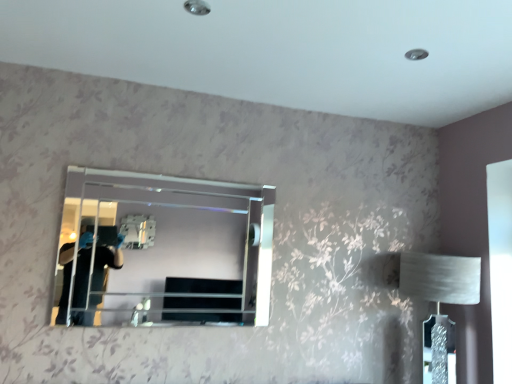
Question: Should I look upward or downward to see clear glass mirror at center?

Choices:
 (A) down
 (B) up

Answer: (A)

Question: Is white fabric lampshade at right at the left side of clear glass mirror at center?

Choices:
 (A) no
 (B) yes

Answer: (A)

Question: Is the depth of white fabric lampshade at right less than that of clear glass mirror at center?

Choices:
 (A) no
 (B) yes

Answer: (A)

Question: Does white fabric lampshade at right lie behind clear glass mirror at center?

Choices:
 (A) no
 (B) yes

Answer: (B)

Question: Considering the relative sizes of white fabric lampshade at right and clear glass mirror at center in the image provided, is white fabric lampshade at right thinner than clear glass mirror at center?

Choices:
 (A) yes
 (B) no

Answer: (B)

Question: Considering the relative sizes of white fabric lampshade at right and clear glass mirror at center in the image provided, is white fabric lampshade at right wider than clear glass mirror at center?

Choices:
 (A) yes
 (B) no

Answer: (A)

Question: Does white fabric lampshade at right have a lesser height compared to clear glass mirror at center?

Choices:
 (A) yes
 (B) no

Answer: (B)

Question: From a real-world perspective, does clear glass mirror at center stand above white fabric lampshade at right?

Choices:
 (A) yes
 (B) no

Answer: (A)

Question: Is clear glass mirror at center not near white fabric lampshade at right?

Choices:
 (A) no
 (B) yes

Answer: (B)

Question: Is clear glass mirror at center further to the viewer compared to white fabric lampshade at right?

Choices:
 (A) yes
 (B) no

Answer: (B)

Question: Is clear glass mirror at center outside of white fabric lampshade at right?

Choices:
 (A) no
 (B) yes

Answer: (B)

Question: Is clear glass mirror at center at the left side of white fabric lampshade at right?

Choices:
 (A) no
 (B) yes

Answer: (B)

Question: Is white fabric lampshade at right at the back of clear glass mirror at center?

Choices:
 (A) yes
 (B) no

Answer: (B)

Question: From a real-world perspective, is white fabric lampshade at right physically located above or below clear glass mirror at center?

Choices:
 (A) above
 (B) below

Answer: (B)